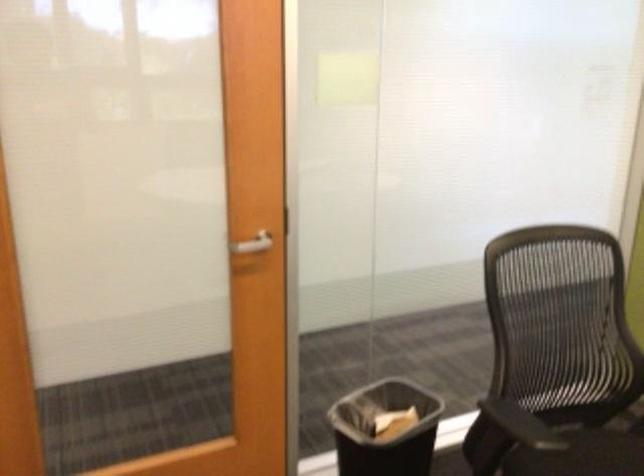
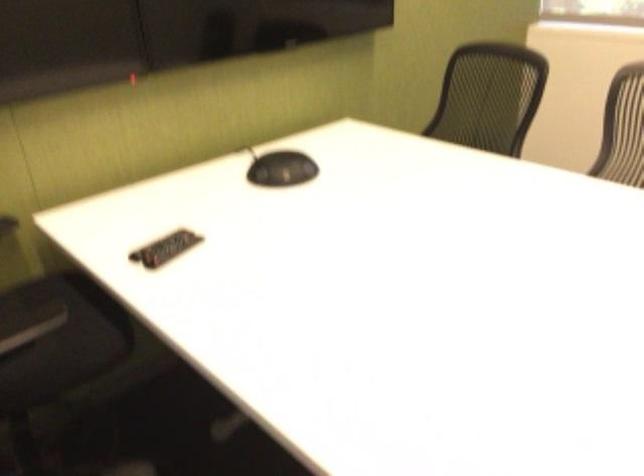
Consider the image. The images are taken continuously from a first-person perspective. In which direction is your viewpoint rotating?

The rotation direction of the camera is right-down.